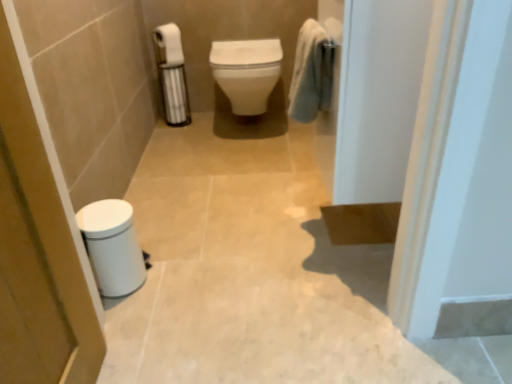
Identify the location of white glossy screen door at upper right, marked as the 1th screen door in a right-to-left arrangement. (378, 97).

In order to click on soft blue towel at upper right in this screenshot , I will do `click(311, 73)`.

The width and height of the screenshot is (512, 384). What do you see at coordinates (168, 45) in the screenshot?
I see `white matte toilet paper at upper left` at bounding box center [168, 45].

I want to click on white matte trash can at lower left, positioned as the 1th screen door in left-to-right order, so click(37, 252).

From the image's perspective, does white glossy trash can at lower left appear lower than white matte trash can at lower left, the 2th screen door from the right?

Yes, from the image's perspective, white glossy trash can at lower left is beneath white matte trash can at lower left, the 2th screen door from the right.

Is white glossy trash can at lower left with white matte trash can at lower left, positioned as the 1th screen door in left-to-right order?

They are not placed beside each other.

Which of these two, white glossy trash can at lower left or white matte trash can at lower left, positioned as the 1th screen door in left-to-right order, is wider?

white glossy trash can at lower left is wider.

Between white glossy trash can at lower left and white matte trash can at lower left, the 2th screen door from the right, which one has larger size?

white matte trash can at lower left, the 2th screen door from the right, is bigger.

From the picture: Can you confirm if white matte trash can at lower left, the 2th screen door from the right, is shorter than white glossy screen door at upper right, marked as the 1th screen door in a right-to-left arrangement?

In fact, white matte trash can at lower left, the 2th screen door from the right, may be taller than white glossy screen door at upper right, marked as the 1th screen door in a right-to-left arrangement.

How much distance is there between white matte trash can at lower left, positioned as the 1th screen door in left-to-right order, and white glossy screen door at upper right, which appears as the 2th screen door when viewed from the left?

white matte trash can at lower left, positioned as the 1th screen door in left-to-right order, and white glossy screen door at upper right, which appears as the 2th screen door when viewed from the left, are 30.86 inches apart.

Is white matte trash can at lower left, the 2th screen door from the right, looking in the opposite direction of white glossy screen door at upper right, which appears as the 2th screen door when viewed from the left?

No, white matte trash can at lower left, the 2th screen door from the right, is not facing the opposite direction of white glossy screen door at upper right, which appears as the 2th screen door when viewed from the left.

Consider the image. Is white matte trash can at lower left, the 2th screen door from the right, wider or thinner than white glossy screen door at upper right, which appears as the 2th screen door when viewed from the left?

Clearly, white matte trash can at lower left, the 2th screen door from the right, has less width compared to white glossy screen door at upper right, which appears as the 2th screen door when viewed from the left.

Where is `bath towel that is in front of the white glossy trash can at lower left`? bath towel that is in front of the white glossy trash can at lower left is located at coordinates (311, 73).

Considering the positions of objects white glossy trash can at lower left and soft blue towel at upper right in the image provided, who is in front, white glossy trash can at lower left or soft blue towel at upper right?

soft blue towel at upper right is in front.

Is white glossy trash can at lower left positioned with its back to soft blue towel at upper right?

white glossy trash can at lower left does not have its back to soft blue towel at upper right.

Based on the photo, which object is wider, white matte toilet paper at upper left or white glossy trash can at lower left?

Wider between the two is white glossy trash can at lower left.

Which of these two, white matte toilet paper at upper left or white glossy trash can at lower left, is bigger?

Bigger between the two is white glossy trash can at lower left.

From the image's perspective, which one is positioned lower, white matte toilet paper at upper left or white glossy trash can at lower left?

From the image's view, white glossy trash can at lower left is below.

Can you confirm if white matte toilet paper at upper left is positioned to the right of white glossy trash can at lower left?

No, white matte toilet paper at upper left is not to the right of white glossy trash can at lower left.

Is white glossy screen door at upper right, marked as the 1th screen door in a right-to-left arrangement, closer to the viewer compared to soft blue towel at upper right?

Yes, it is in front of soft blue towel at upper right.

Which object is positioned more to the right, white glossy screen door at upper right, which appears as the 2th screen door when viewed from the left, or soft blue towel at upper right?

white glossy screen door at upper right, which appears as the 2th screen door when viewed from the left, is more to the right.

What are the coordinates of `the 2nd screen door directly beneath the soft blue towel at upper right (from a real-world perspective)` in the screenshot? It's located at (378, 97).

Is the surface of white glossy screen door at upper right, marked as the 1th screen door in a right-to-left arrangement, in direct contact with soft blue towel at upper right?

No, white glossy screen door at upper right, marked as the 1th screen door in a right-to-left arrangement, is not with soft blue towel at upper right.

Between soft blue towel at upper right and white glossy toilet at center, which one appears on the right side from the viewer's perspective?

Positioned to the right is soft blue towel at upper right.

Are soft blue towel at upper right and white glossy toilet at center making contact?

There is a gap between soft blue towel at upper right and white glossy toilet at center.

The image size is (512, 384). What are the coordinates of `bath towel lying in front of the white glossy toilet at center` in the screenshot? It's located at (311, 73).

Is soft blue towel at upper right spatially inside white glossy toilet at center, or outside of it?

soft blue towel at upper right is outside white glossy toilet at center.

Which of these two, soft blue towel at upper right or white glossy screen door at upper right, which appears as the 2th screen door when viewed from the left, stands taller?

white glossy screen door at upper right, which appears as the 2th screen door when viewed from the left.

Is soft blue towel at upper right with white glossy screen door at upper right, marked as the 1th screen door in a right-to-left arrangement?

No.

From the image's perspective, is soft blue towel at upper right above or below white glossy screen door at upper right, marked as the 1th screen door in a right-to-left arrangement?

Clearly, from the image's perspective, soft blue towel at upper right is above white glossy screen door at upper right, marked as the 1th screen door in a right-to-left arrangement.

Find the location of a particular element. Image resolution: width=512 pixels, height=384 pixels. the 1st screen door in front of the white glossy trash can at lower left is located at coordinates (37, 252).

Where is `screen door behind the white glossy screen door at upper right, which appears as the 2th screen door when viewed from the left`? The height and width of the screenshot is (384, 512). screen door behind the white glossy screen door at upper right, which appears as the 2th screen door when viewed from the left is located at coordinates (37, 252).

Looking at the image, which one is located further to white glossy screen door at upper right, which appears as the 2th screen door when viewed from the left, white matte toilet paper at upper left or soft blue towel at upper right?

white matte toilet paper at upper left.

Which object lies further to the anchor point white glossy trash can at lower left, white matte toilet paper at upper left or white glossy screen door at upper right, which appears as the 2th screen door when viewed from the left?

white matte toilet paper at upper left is further to white glossy trash can at lower left.

Looking at the image, which one is located further to soft blue towel at upper right, white glossy trash can at lower left or white glossy toilet at center?

The object further to soft blue towel at upper right is white glossy toilet at center.

From the image, which object appears to be farther from white glossy screen door at upper right, which appears as the 2th screen door when viewed from the left, white matte toilet paper at upper left or white glossy trash can at lower left?

white matte toilet paper at upper left is positioned further to the anchor white glossy screen door at upper right, which appears as the 2th screen door when viewed from the left.

From the image, which object appears to be farther from white glossy screen door at upper right, marked as the 1th screen door in a right-to-left arrangement, white glossy toilet at center or white matte toilet paper at upper left?

white matte toilet paper at upper left is further to white glossy screen door at upper right, marked as the 1th screen door in a right-to-left arrangement.

When comparing their distances from soft blue towel at upper right, does white glossy toilet at center or white glossy trash can at lower left seem closer?

Based on the image, white glossy trash can at lower left appears to be nearer to soft blue towel at upper right.

From the image, which object appears to be farther from soft blue towel at upper right, white glossy trash can at lower left or white glossy screen door at upper right, which appears as the 2th screen door when viewed from the left?

white glossy trash can at lower left.

From the image, which object appears to be farther from white glossy toilet at center, white glossy screen door at upper right, marked as the 1th screen door in a right-to-left arrangement, or white glossy trash can at lower left?

white glossy screen door at upper right, marked as the 1th screen door in a right-to-left arrangement, is positioned further to the anchor white glossy toilet at center.

Image resolution: width=512 pixels, height=384 pixels. I want to click on toilet between white glossy screen door at upper right, marked as the 1th screen door in a right-to-left arrangement, and white matte toilet paper at upper left, along the z-axis, so click(247, 72).

Where is `bath towel between white glossy screen door at upper right, which appears as the 2th screen door when viewed from the left, and white glossy toilet at center from front to back`? The width and height of the screenshot is (512, 384). bath towel between white glossy screen door at upper right, which appears as the 2th screen door when viewed from the left, and white glossy toilet at center from front to back is located at coordinates (311, 73).

Locate an element on the screen. porcelain between white matte trash can at lower left, positioned as the 1th screen door in left-to-right order, and white glossy screen door at upper right, which appears as the 2th screen door when viewed from the left, in the horizontal direction is located at coordinates (112, 246).

Where is `toilet located between white matte trash can at lower left, positioned as the 1th screen door in left-to-right order, and white matte toilet paper at upper left in the depth direction`? toilet located between white matte trash can at lower left, positioned as the 1th screen door in left-to-right order, and white matte toilet paper at upper left in the depth direction is located at coordinates (247, 72).